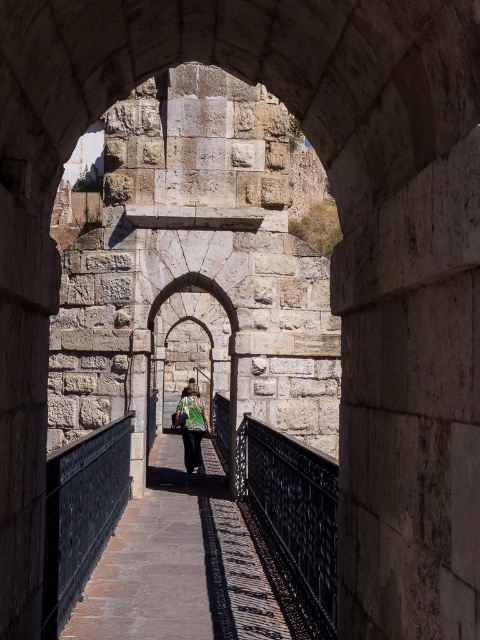
Can you confirm if brown stone path at center is smaller than stone archway at center?

Yes, brown stone path at center is smaller than stone archway at center.

Between point (229, 532) and point (218, 388), which one is positioned behind?

The point (218, 388) is behind.

Is point (216, 627) closer to camera compared to point (216, 291)?

Yes, point (216, 627) is closer to viewer.

Find the location of a particular element. brown stone path at center is located at coordinates (184, 564).

What do you see at coordinates (184, 564) in the screenshot? I see `brown stone path at center` at bounding box center [184, 564].

Does point (183, 484) come closer to viewer compared to point (320, 579)?

No, (183, 484) is further to viewer.

At what (x,y) coordinates should I click in order to perform the action: click on brown stone path at center. Please return your answer as a coordinate pair (x, y). This screenshot has height=640, width=480. Looking at the image, I should click on (184, 564).

Which is behind, point (331, 600) or point (236, 330)?

Positioned behind is point (236, 330).

Between black wrought iron railing at center and stone archway at center, which one has more height?

Standing taller between the two is stone archway at center.

Locate an element on the screen. This screenshot has width=480, height=640. black wrought iron railing at center is located at coordinates (294, 513).